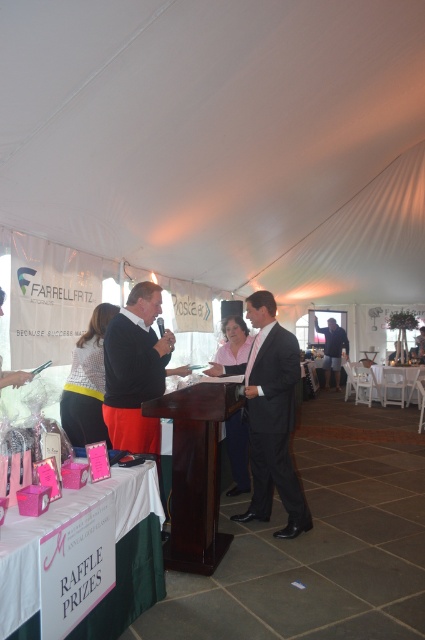
Question: Which point appears farthest from the camera in this image?

Choices:
 (A) (336, 346)
 (B) (11, 552)
 (C) (251, 337)
 (D) (397, 369)

Answer: (A)

Question: Is wooden podium at center behind orange knit sweater at center?

Choices:
 (A) yes
 (B) no

Answer: (B)

Question: Which point is closer to the camera taking this photo?

Choices:
 (A) (326, 339)
 (B) (274, 440)
 (C) (192, 516)

Answer: (C)

Question: Is wooden podium at center closer to the viewer compared to light brown leather jacket at center?

Choices:
 (A) yes
 (B) no

Answer: (A)

Question: Where is wooden podium at center located in relation to light brown leather jacket at center in the image?

Choices:
 (A) right
 (B) left

Answer: (B)

Question: Among these points, which one is nearest to the camera?

Choices:
 (A) (73, 392)
 (B) (325, 328)
 (C) (19, 589)

Answer: (C)